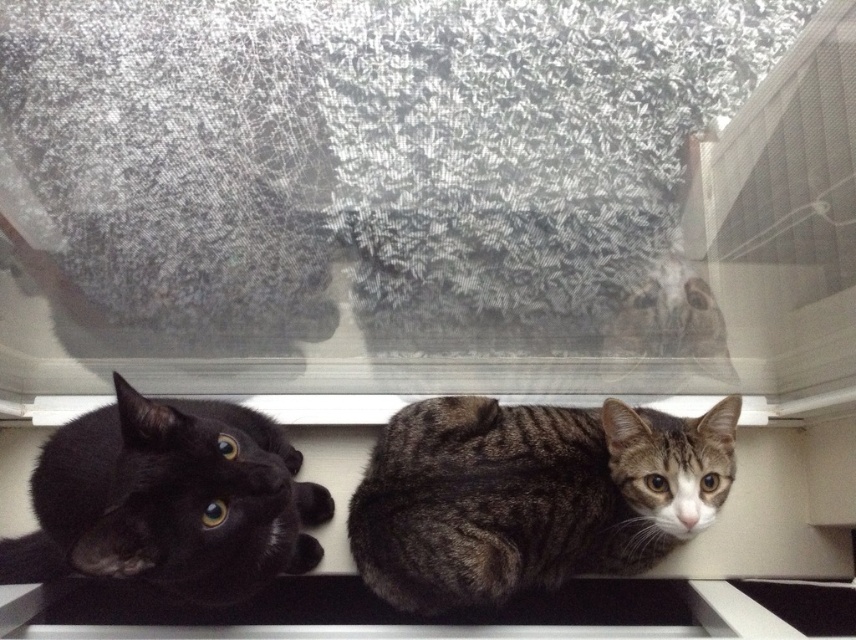
Between point (479, 532) and point (765, 413), which one is positioned behind?

Positioned behind is point (765, 413).

Is tabby fur cat at lower right below white plastic window sill at center?

Yes, tabby fur cat at lower right is below white plastic window sill at center.

Who is more forward, (375, 538) or (633, 403)?

Positioned in front is point (375, 538).

Locate an element on the screen. tabby fur cat at lower right is located at coordinates (530, 496).

You are a GUI agent. You are given a task and a screenshot of the screen. Output one action in this format:
    pyautogui.click(x=<x>, y=<y>)
    Task: Click on the transparent glass window at center
    The height and width of the screenshot is (640, 856).
    Given the screenshot: What is the action you would take?
    pyautogui.click(x=426, y=198)

Who is more forward, [266,96] or [407,589]?

Point [266,96]

Locate an element on the screen. transparent glass window at center is located at coordinates (426, 198).

In order to click on transparent glass window at center in this screenshot , I will do `click(426, 198)`.

From the picture: Is transparent glass window at center closer to camera compared to matte black cat at lower left?

No, it is behind matte black cat at lower left.

Does point (507, 198) come in front of point (299, 504)?

Yes, point (507, 198) is in front of point (299, 504).

The width and height of the screenshot is (856, 640). Find the location of `transparent glass window at center`. transparent glass window at center is located at coordinates (426, 198).